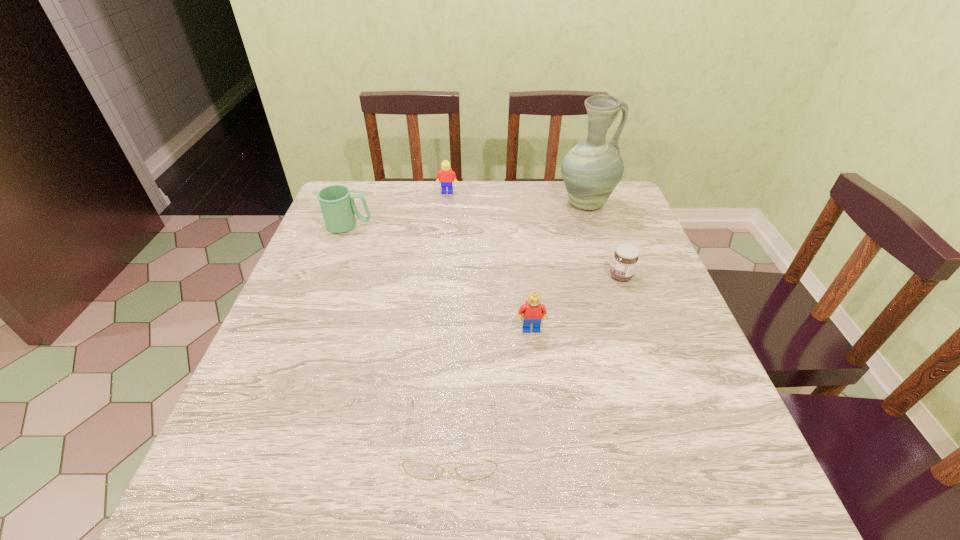
Where is `pitcher at the right edge`? The height and width of the screenshot is (540, 960). pitcher at the right edge is located at coordinates (591, 170).

The image size is (960, 540). I want to click on jam positioned at the right edge, so [626, 256].

This screenshot has width=960, height=540. I want to click on object present at the far left corner, so click(x=338, y=208).

This screenshot has width=960, height=540. I want to click on object that is at the far right corner, so click(x=591, y=170).

What are the coordinates of `vacant space at the far edge of the desktop` in the screenshot? It's located at (468, 202).

The width and height of the screenshot is (960, 540). I want to click on vacant space at the left edge, so 273,348.

This screenshot has width=960, height=540. In the image, there is a desktop. Identify the location of free space at the right edge. (631, 336).

This screenshot has height=540, width=960. What are the coordinates of `free location at the near left corner of the desktop` in the screenshot? It's located at (240, 508).

Find the location of a particular element. The height and width of the screenshot is (540, 960). free space between the leftmost object and the nearest object is located at coordinates (400, 333).

Where is `empty space that is in between the mug and the jam`? This screenshot has height=540, width=960. empty space that is in between the mug and the jam is located at coordinates (485, 251).